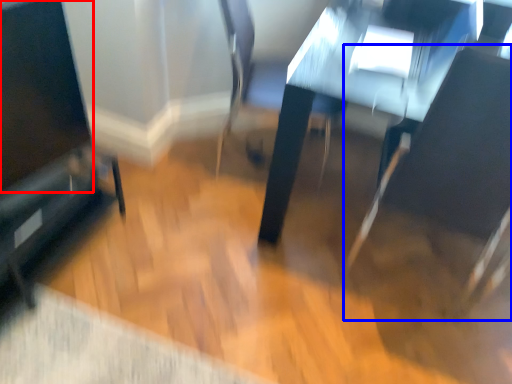
Question: Among these objects, which one is farthest to the camera, screen (highlighted by a red box) or swivel chair (highlighted by a blue box)?

Choices:
 (A) screen
 (B) swivel chair

Answer: (A)